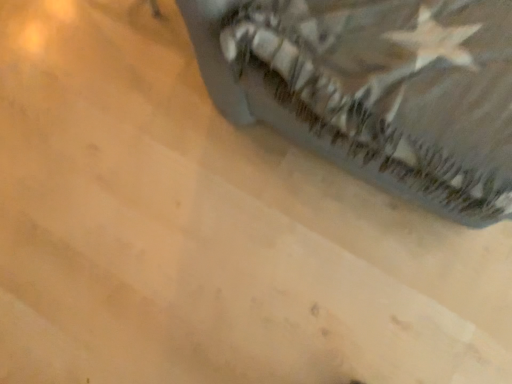
Identify the location of metallic gray vase at upper right. This screenshot has height=384, width=512. (375, 89).

The image size is (512, 384). Describe the element at coordinates (375, 89) in the screenshot. I see `metallic gray vase at upper right` at that location.

Locate an element on the screen. This screenshot has width=512, height=384. metallic gray vase at upper right is located at coordinates (375, 89).